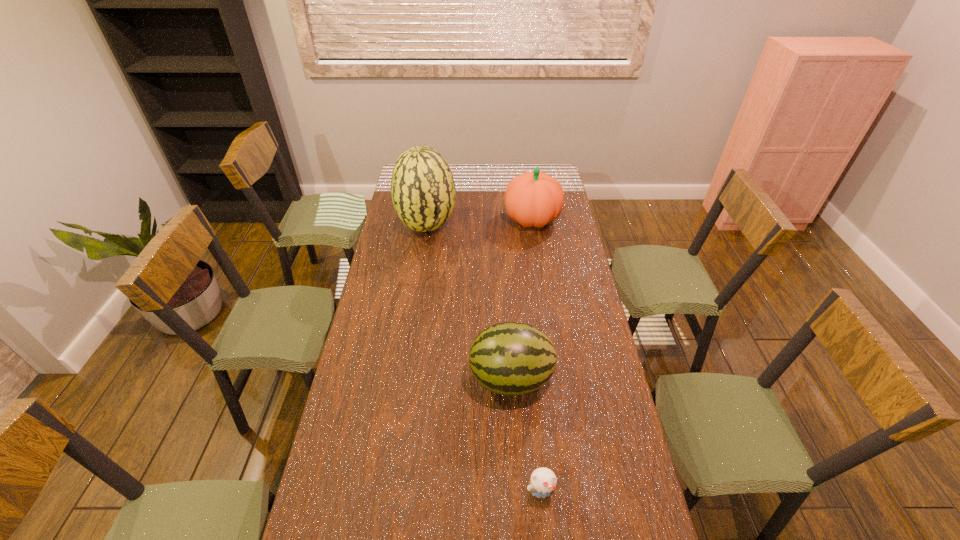
Where is `the farther watermelon`? The height and width of the screenshot is (540, 960). the farther watermelon is located at coordinates pos(423,191).

Image resolution: width=960 pixels, height=540 pixels. I want to click on the tallest object, so click(423, 191).

Where is `pumpkin`? This screenshot has width=960, height=540. pumpkin is located at coordinates (533, 199).

The width and height of the screenshot is (960, 540). I want to click on the right watermelon, so click(510, 358).

You are a GUI agent. You are given a task and a screenshot of the screen. Output one action in this format:
    pyautogui.click(x=<x>, y=<y>)
    Task: Click on the shorter watermelon
    This screenshot has width=960, height=540.
    Given the screenshot: What is the action you would take?
    tap(510, 358)

The width and height of the screenshot is (960, 540). What are the coordinates of `kitten` in the screenshot? It's located at (543, 480).

Find the location of `the shortest object`. the shortest object is located at coordinates (543, 480).

Identify the location of vacant space located 0.130m on the right of the tallest object. The width and height of the screenshot is (960, 540). (484, 226).

I want to click on blank area located 0.050m on the front of the pumpkin, so click(536, 243).

Find the location of a particular element. The image size is (960, 540). free space located at the stem end of the second shortest object is located at coordinates [401, 379].